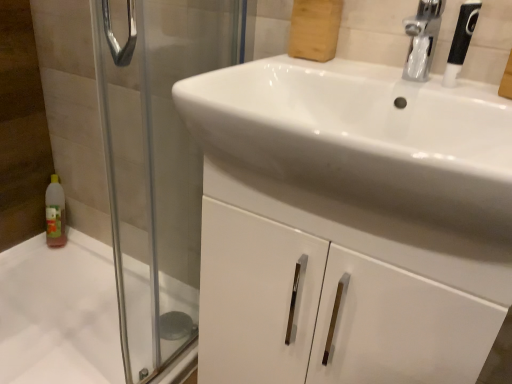
Where is `white glossy sink at center`? This screenshot has width=512, height=384. white glossy sink at center is located at coordinates (364, 137).

Find the location of a particular element. white glossy cabinet at center is located at coordinates (340, 287).

What is the approximate width of transparent glass screen door at left?

The width of transparent glass screen door at left is 3.27 inches.

The width and height of the screenshot is (512, 384). What do you see at coordinates (157, 163) in the screenshot?
I see `transparent glass screen door at left` at bounding box center [157, 163].

The image size is (512, 384). I want to click on white glossy sink at center, so click(x=364, y=137).

Considering the points (119, 71) and (239, 289), which point is behind, point (119, 71) or point (239, 289)?

The point (119, 71) is more distant.

Can you confirm if transparent glass screen door at left is positioned to the right of white glossy cabinet at center?

In fact, transparent glass screen door at left is to the left of white glossy cabinet at center.

Between transparent glass screen door at left and white glossy cabinet at center, which one has smaller size?

transparent glass screen door at left is smaller.

Is white glossy sink at center aimed at white glossy cabinet at center?

No, white glossy sink at center does not turn towards white glossy cabinet at center.

Do you think white glossy sink at center is within white glossy cabinet at center, or outside of it?

white glossy sink at center cannot be found inside white glossy cabinet at center.

How many degrees apart are the facing directions of white glossy sink at center and white glossy cabinet at center?

They differ by 0.0204 degrees in their facing directions.

In the image, is white glossy sink at center positioned in front of or behind white glossy cabinet at center?

Visually, white glossy sink at center is located in front of white glossy cabinet at center.

Based on the photo, is black textured shower head at upper right in front of or behind transparent glass screen door at left in the image?

Visually, black textured shower head at upper right is located behind transparent glass screen door at left.

Which is more to the right, black textured shower head at upper right or transparent glass screen door at left?

From the viewer's perspective, black textured shower head at upper right appears more on the right side.

Would you say black textured shower head at upper right contains transparent glass screen door at left?

Actually, transparent glass screen door at left is outside black textured shower head at upper right.

Is white glossy cabinet at center completely or partially outside of transparent glass screen door at left?

Yes, white glossy cabinet at center is not within transparent glass screen door at left.

Is white glossy cabinet at center positioned far away from transparent glass screen door at left?

white glossy cabinet at center is actually quite close to transparent glass screen door at left.

From the image's perspective, is white glossy cabinet at center above transparent glass screen door at left?

Incorrect, from the image's perspective, white glossy cabinet at center is lower than transparent glass screen door at left.

Can you tell me how much white glossy cabinet at center and transparent glass screen door at left differ in facing direction?

The angle between the facing direction of white glossy cabinet at center and the facing direction of transparent glass screen door at left is 79.5 degrees.

Is white glossy bath at lower left touching transparent glass screen door at left?

white glossy bath at lower left is not next to transparent glass screen door at left, and they're not touching.

Between white glossy bath at lower left and transparent glass screen door at left, which one is positioned behind?

Positioned behind is white glossy bath at lower left.

Is point (29, 313) closer or farther from the camera than point (109, 99)?

Point (29, 313).

Can you confirm if white glossy bath at lower left is taller than transparent glass screen door at left?

No, white glossy bath at lower left is not taller than transparent glass screen door at left.

From the picture: Based on their sizes in the image, would you say white glossy sink at center is bigger or smaller than transparent glass screen door at left?

In the image, white glossy sink at center appears to be larger than transparent glass screen door at left.

There is a transparent glass screen door at left. Where is `sink above it (from a real-world perspective)`? sink above it (from a real-world perspective) is located at coordinates (364, 137).

From a real-world perspective, which is physically below, white glossy sink at center or transparent glass screen door at left?

transparent glass screen door at left, from a real-world perspective.

Is white glossy sink at center to the left of transparent glass screen door at left from the viewer's perspective?

In fact, white glossy sink at center is to the right of transparent glass screen door at left.

Is white glossy cabinet at center to the left of black textured shower head at upper right from the viewer's perspective?

Indeed, white glossy cabinet at center is positioned on the left side of black textured shower head at upper right.

Find the location of a particular element. This screenshot has width=512, height=384. shower located above the white glossy cabinet at center (from the image's perspective) is located at coordinates (461, 40).

Considering the positions of objects white glossy cabinet at center and black textured shower head at upper right in the image provided, who is behind, white glossy cabinet at center or black textured shower head at upper right?

black textured shower head at upper right is further from the camera.

Is white glossy cabinet at center not inside black textured shower head at upper right?

Yes, white glossy cabinet at center is not within black textured shower head at upper right.

The image size is (512, 384). In the image, there is a white glossy cabinet at center. Find the location of `screen door above it (from the image's perspective)`. screen door above it (from the image's perspective) is located at coordinates (157, 163).

At what (x,y) coordinates should I click in order to perform the action: click on sink above the white glossy cabinet at center (from a real-world perspective). Please return your answer as a coordinate pair (x, y). The image size is (512, 384). Looking at the image, I should click on (364, 137).

From the image, which object appears to be farther from white glossy bath at lower left, transparent glass screen door at left or black textured shower head at upper right?

black textured shower head at upper right.

Looking at the image, which one is located closer to white glossy bath at lower left, white glossy sink at center or white glossy cabinet at center?

white glossy cabinet at center is positioned closer to the anchor white glossy bath at lower left.

From the image, which object appears to be farther from white glossy sink at center, transparent glass screen door at left or black textured shower head at upper right?

The object further to white glossy sink at center is transparent glass screen door at left.

From the image, which object appears to be farther from white glossy sink at center, white glossy bath at lower left or black textured shower head at upper right?

white glossy bath at lower left lies further to white glossy sink at center than the other object.

Looking at the image, which one is located further to transparent glass screen door at left, white glossy bath at lower left or white glossy cabinet at center?

Based on the image, white glossy cabinet at center appears to be further to transparent glass screen door at left.

Based on their spatial positions, is white glossy sink at center or white glossy bath at lower left further from black textured shower head at upper right?

white glossy bath at lower left lies further to black textured shower head at upper right than the other object.

Looking at the image, which one is located further to white glossy cabinet at center, transparent glass screen door at left or white glossy bath at lower left?

white glossy bath at lower left.

When comparing their distances from black textured shower head at upper right, does white glossy sink at center or white glossy cabinet at center seem further?

white glossy cabinet at center.

At what (x,y) coordinates should I click in order to perform the action: click on bathroom cabinet situated between transparent glass screen door at left and black textured shower head at upper right from left to right. Please return your answer as a coordinate pair (x, y). The height and width of the screenshot is (384, 512). Looking at the image, I should click on (340, 287).

This screenshot has height=384, width=512. Find the location of `bathroom cabinet between white glossy bath at lower left and black textured shower head at upper right from left to right`. bathroom cabinet between white glossy bath at lower left and black textured shower head at upper right from left to right is located at coordinates (340, 287).

The image size is (512, 384). Identify the location of sink between black textured shower head at upper right and white glossy cabinet at center vertically. (364, 137).

Image resolution: width=512 pixels, height=384 pixels. What are the coordinates of `sink situated between transparent glass screen door at left and white glossy cabinet at center from left to right` in the screenshot? It's located at (364, 137).